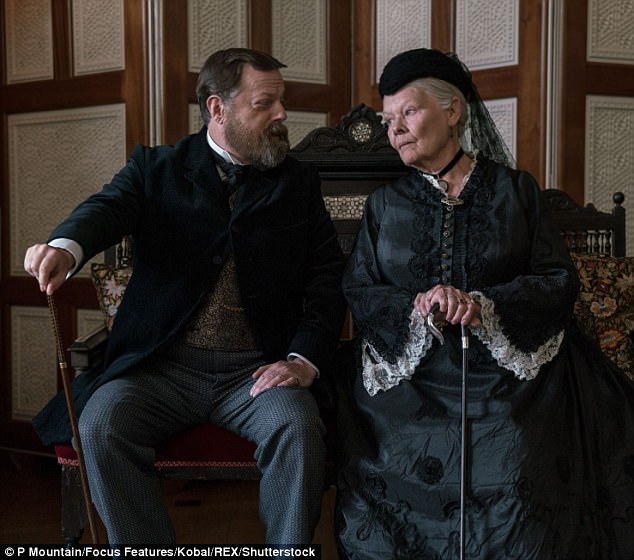
At what (x,y) coordinates should I click in order to perform the action: click on room divider. Please return your answer as a coordinate pair (x, y). This screenshot has height=560, width=634. Looking at the image, I should click on (299, 30).